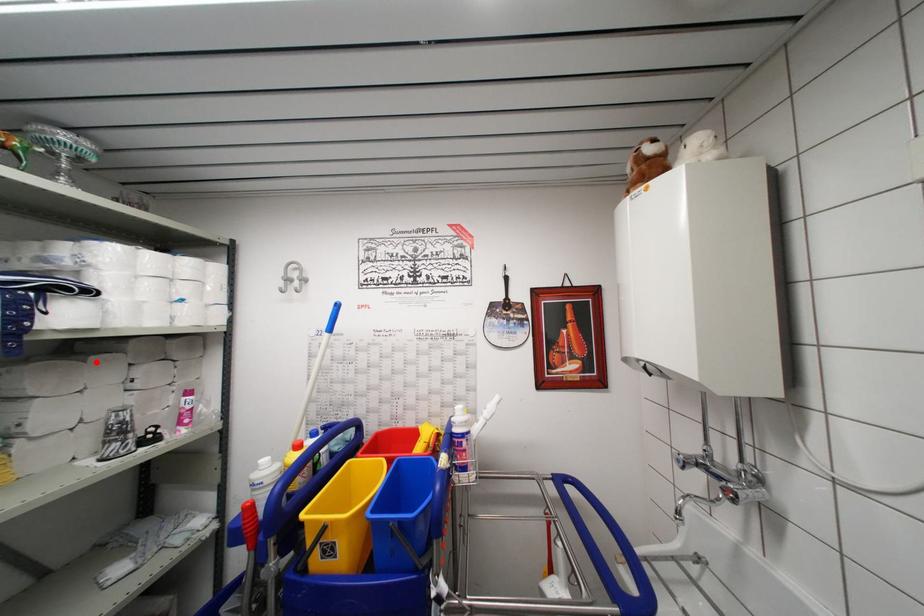
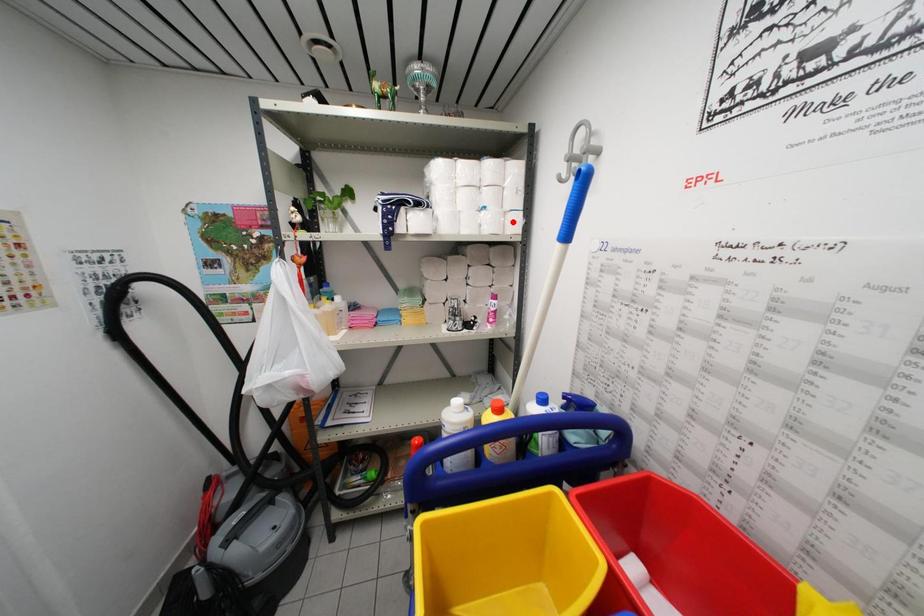
I am providing you with two images of the same scene from different viewpoints. A red point is marked on the first image and another point is marked on the second image. Is the red point in image1 aligned with the point shown in image2?

→ No